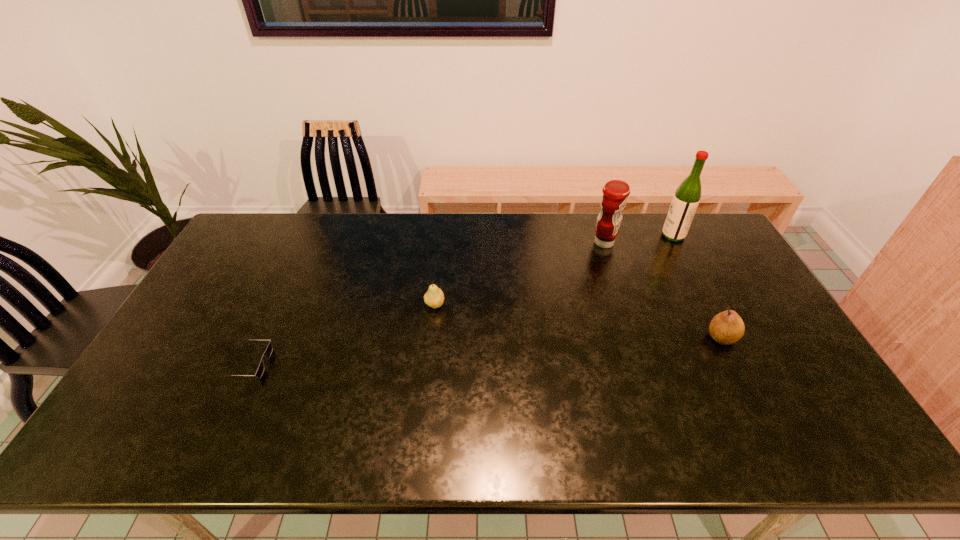
I want to click on free point that satisfies the following two spatial constraints: 1. on the back side of the third farthest object; 2. on the left side of the third object from right to left, so click(x=442, y=243).